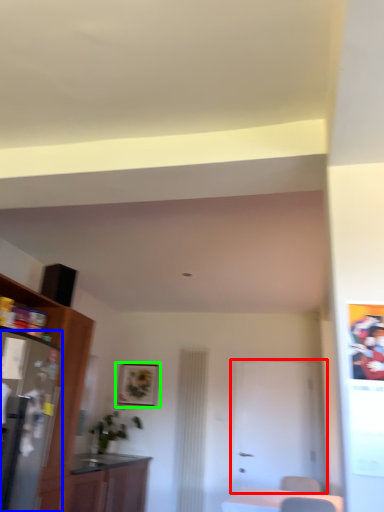
Question: Which is farther away from door (highlighted by a red box)? appliance (highlighted by a blue box) or picture frame (highlighted by a green box)?

Choices:
 (A) appliance
 (B) picture frame

Answer: (A)